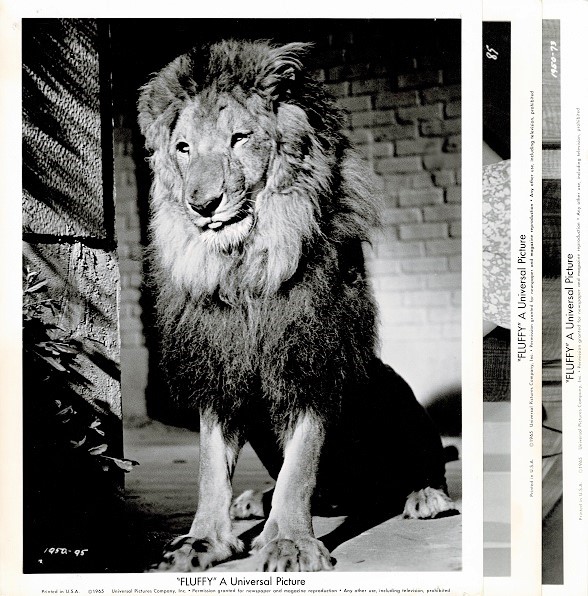
At what (x,y) coordinates should I click in order to perform the action: click on wall. Please return your answer as a coordinate pair (x, y). Looking at the image, I should click on (397, 139).